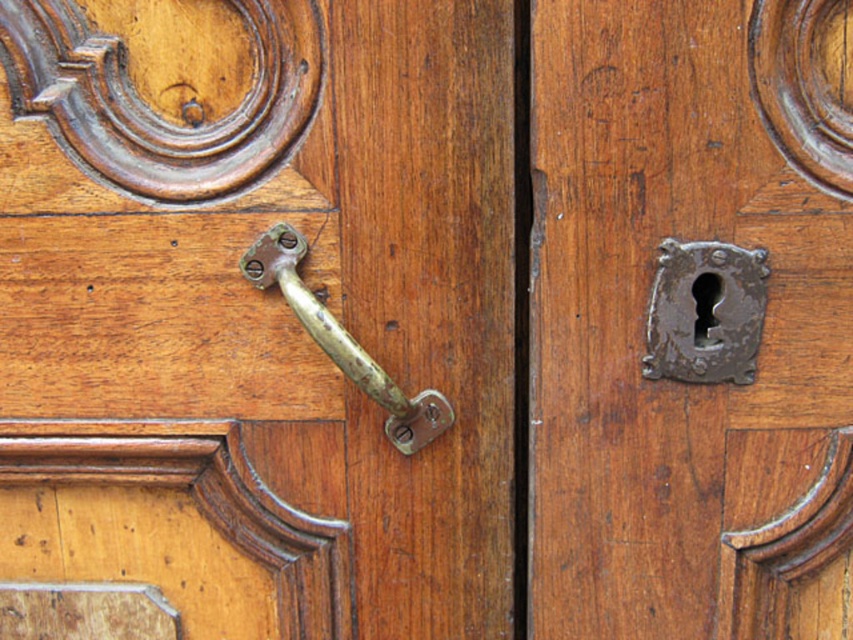
Question: Does rusty metal keyhole at center come behind rusty metal keyhole at right?

Choices:
 (A) no
 (B) yes

Answer: (A)

Question: Based on their relative distances, which object is nearer to the gold polished metal door handle at center?

Choices:
 (A) rusty metal keyhole at right
 (B) rusty metal keyhole at center
 (C) brass/bronze handle at center

Answer: (C)

Question: Is rusty metal keyhole at right wider than gold polished metal door handle at center?

Choices:
 (A) no
 (B) yes

Answer: (A)

Question: Which point is closer to the camera?

Choices:
 (A) gold polished metal door handle at center
 (B) rusty metal keyhole at right
 (C) rusty metal keyhole at center
 (D) brass/bronze handle at center

Answer: (C)

Question: Is rusty metal keyhole at right above gold polished metal door handle at center?

Choices:
 (A) no
 (B) yes

Answer: (B)

Question: Which object is the closest to the rusty metal keyhole at center?

Choices:
 (A) gold polished metal door handle at center
 (B) rusty metal keyhole at right

Answer: (B)